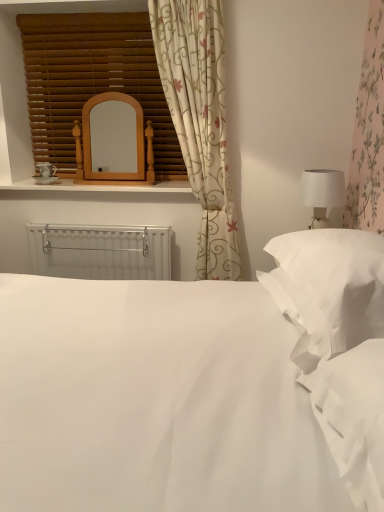
Question: Considering the positions of white smooth bed at center and white soft pillow at right in the image, is white smooth bed at center taller or shorter than white soft pillow at right?

Choices:
 (A) short
 (B) tall

Answer: (B)

Question: Based on their positions, is white smooth bed at center located to the left or right of white soft pillow at right?

Choices:
 (A) right
 (B) left

Answer: (B)

Question: Which object is positioned farthest from the floral fabric curtain at upper center?

Choices:
 (A) wooden blinds at upper left
 (B) white plastic radiator at center
 (C) white soft pillow at right
 (D) white smooth bed at center
 (E) woodenmaterial/texturewindow sill at upper center

Answer: (D)

Question: Estimate the real-world distances between objects in this image. Which object is closer to the white plastic radiator at center?

Choices:
 (A) wooden blinds at upper left
 (B) white matte table lamp at right
 (C) floral fabric curtain at upper center
 (D) woodenmaterial/texturewindow sill at upper center
 (E) wooden mirror at upper center

Answer: (D)